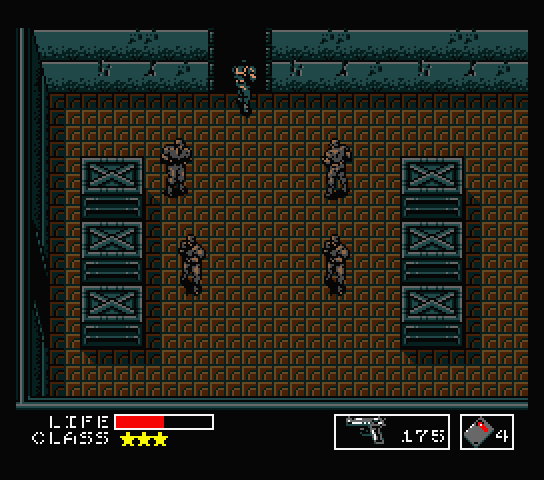
Find the location of a particular element. This screenshot has width=544, height=480. corners is located at coordinates (12, 468), (531, 477), (533, 8), (14, 15).